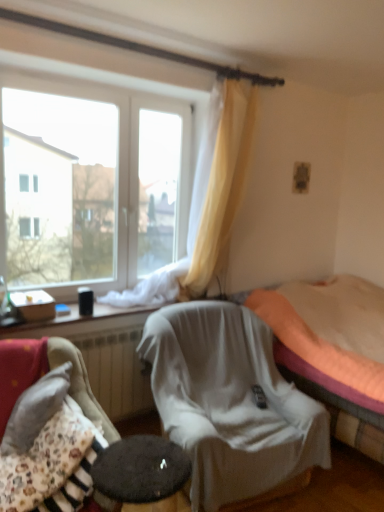
Question: Is floral fabric cushion at lower left, positioned as the 1th chair in left-to-right order, not close to orange fabric bed at center?

Choices:
 (A) no
 (B) yes

Answer: (B)

Question: Does floral fabric cushion at lower left, which is the second chair in back-to-front order, have a smaller size compared to orange fabric bed at center?

Choices:
 (A) no
 (B) yes

Answer: (B)

Question: Does floral fabric cushion at lower left, which ranks as the 2th chair in right-to-left order, have a greater height compared to orange fabric bed at center?

Choices:
 (A) yes
 (B) no

Answer: (B)

Question: From a real-world perspective, does floral fabric cushion at lower left, which ranks as the 2th chair in right-to-left order, stand above orange fabric bed at center?

Choices:
 (A) no
 (B) yes

Answer: (B)

Question: Does floral fabric cushion at lower left, which ranks as the 2th chair in right-to-left order, lie in front of orange fabric bed at center?

Choices:
 (A) yes
 (B) no

Answer: (A)

Question: Is transparent plastic container at lower left, placed as the 1th window when sorted from bottom to top, wider or thinner than orange fabric bed at center?

Choices:
 (A) wide
 (B) thin

Answer: (B)

Question: Is transparent plastic container at lower left, placed as the 1th window when sorted from bottom to top, spatially inside orange fabric bed at center, or outside of it?

Choices:
 (A) outside
 (B) inside

Answer: (A)

Question: Based on their sizes in the image, would you say transparent plastic container at lower left, placed as the 1th window when sorted from bottom to top, is bigger or smaller than orange fabric bed at center?

Choices:
 (A) big
 (B) small

Answer: (B)

Question: Is transparent plastic container at lower left, arranged as the second window when viewed from the top, taller or shorter than orange fabric bed at center?

Choices:
 (A) short
 (B) tall

Answer: (A)

Question: In the image, is floral fabric cushion at lower left, which is the second chair in back-to-front order, positioned in front of or behind transparent plastic container at lower left, arranged as the second window when viewed from the top?

Choices:
 (A) behind
 (B) front

Answer: (B)

Question: Considering the positions of point (74, 388) and point (115, 309), is point (74, 388) closer or farther from the camera than point (115, 309)?

Choices:
 (A) closer
 (B) farther

Answer: (A)

Question: Considering the positions of floral fabric cushion at lower left, positioned as the 1th chair in left-to-right order, and transparent plastic container at lower left, arranged as the second window when viewed from the top, in the image, is floral fabric cushion at lower left, positioned as the 1th chair in left-to-right order, taller or shorter than transparent plastic container at lower left, arranged as the second window when viewed from the top,?

Choices:
 (A) short
 (B) tall

Answer: (B)

Question: From a real-world perspective, is floral fabric cushion at lower left, positioned as the 1th chair in left-to-right order, positioned above or below transparent plastic container at lower left, arranged as the second window when viewed from the top?

Choices:
 (A) below
 (B) above

Answer: (A)

Question: Considering the positions of floral fabric cushion at lower left, which ranks as the 2th chair in right-to-left order, and transparent glass window at upper left, arranged as the first window when viewed from the top, in the image, is floral fabric cushion at lower left, which ranks as the 2th chair in right-to-left order, wider or thinner than transparent glass window at upper left, arranged as the first window when viewed from the top,?

Choices:
 (A) wide
 (B) thin

Answer: (A)

Question: Considering their positions, is floral fabric cushion at lower left, which ranks as the 2th chair in right-to-left order, located in front of or behind transparent glass window at upper left, arranged as the first window when viewed from the top?

Choices:
 (A) front
 (B) behind

Answer: (A)